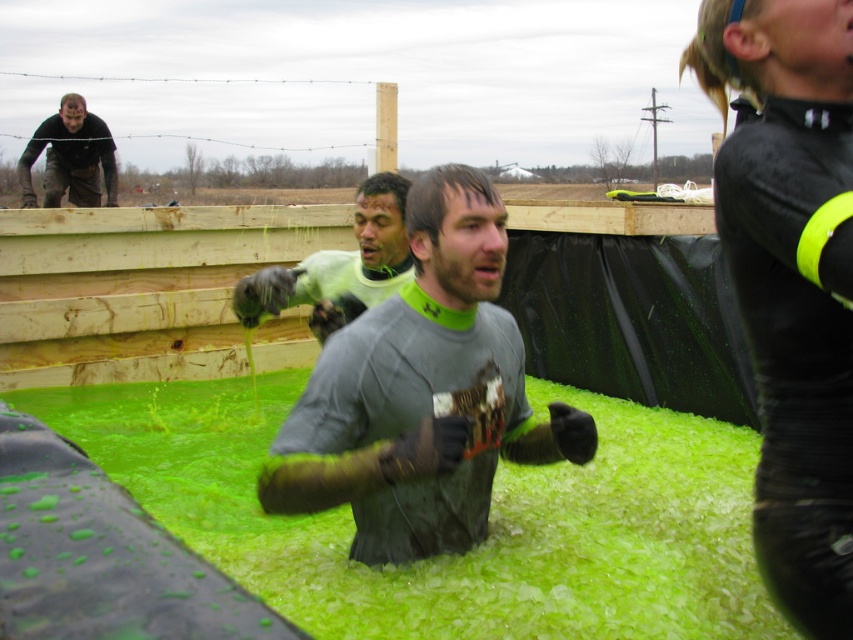
You are a participant in the obstacle course and need to step through the green slime at center. Your goal is to avoid getting your green matte shirt at center completely soaked. Can you do it?

The green slime at center has a larger size compared to green matte shirt at center, so it is possible to step through the slime without fully submerging the green matte shirt at center.

You are a photographer at the event and want to capture both the gray matte shirt at center and the matte black shirt at upper left in a single shot. Based on their positions, which one is lower in the frame?

The gray matte shirt at center is below the matte black shirt at upper left, so the gray matte shirt at center is lower in the frame.

You are a photographer trying to capture the best angle of the obstacle course event. You notice two key points marked as point (299, 486) and point (80, 173) in the image. Which point should you focus on to ensure it appears larger in your photo?

Point (299, 486) is closer to the camera than point (80, 173), so focusing on point (299, 486) will make it appear larger in the photo.